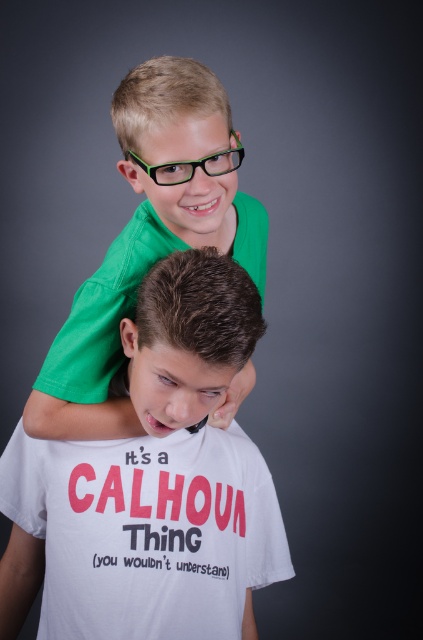
Question: Is white cotton t-shirt at center smaller than green plastic glasses at upper center?

Choices:
 (A) no
 (B) yes

Answer: (A)

Question: Considering the real-world distances, which object is farthest from the green matte shirt at upper center?

Choices:
 (A) brown matte hair at center
 (B) green matte glasses at upper center

Answer: (A)

Question: Can you confirm if green matte shirt at upper center is positioned to the left of green plastic glasses at upper center?

Choices:
 (A) yes
 (B) no

Answer: (A)

Question: Does green matte shirt at upper center come in front of green plastic glasses at upper center?

Choices:
 (A) yes
 (B) no

Answer: (A)

Question: Considering the real-world distances, which object is farthest from the green matte glasses at upper center?

Choices:
 (A) white cotton t-shirt at center
 (B) brown matte hair at center
 (C) green plastic glasses at upper center
 (D) green matte shirt at upper center

Answer: (A)

Question: Which point is farther to the camera?

Choices:
 (A) green matte glasses at upper center
 (B) green matte shirt at upper center
 (C) white cotton t-shirt at center

Answer: (C)